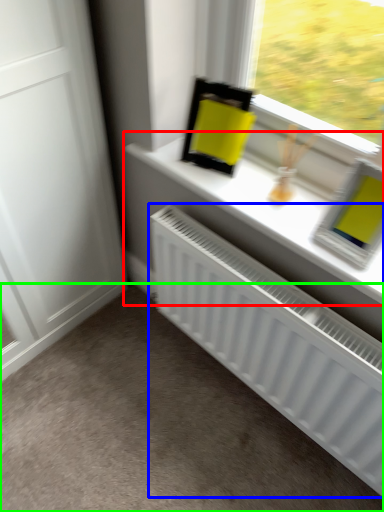
Question: Which object is positioned closest to window sill (highlighted by a red box)? Select from radiator (highlighted by a blue box) and plain (highlighted by a green box).

Choices:
 (A) radiator
 (B) plain

Answer: (A)